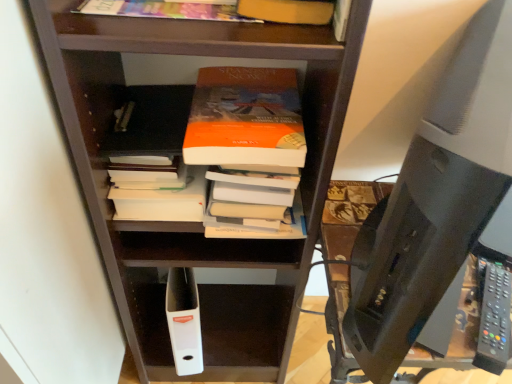
Question: Could you tell me if brown wooden shelf at center is facing white matte book at center, which ranks as the third book in top-to-bottom order?

Choices:
 (A) yes
 (B) no

Answer: (A)

Question: Is brown wooden shelf at center shorter than white matte book at center, which is the 3th book in front-to-back order?

Choices:
 (A) no
 (B) yes

Answer: (A)

Question: Is brown wooden shelf at center facing away from white matte book at center, which is the first book in back-to-front order?

Choices:
 (A) yes
 (B) no

Answer: (A)

Question: Would you consider brown wooden shelf at center to be distant from white matte book at center, which is the 3th book in front-to-back order?

Choices:
 (A) yes
 (B) no

Answer: (B)

Question: From the image's perspective, would you say brown wooden shelf at center is shown under white matte book at center, which appears as the first book when ordered from the bottom?

Choices:
 (A) no
 (B) yes

Answer: (B)

Question: Is brown wooden shelf at center spatially inside white matte book at center, which is the first book in back-to-front order, or outside of it?

Choices:
 (A) outside
 (B) inside

Answer: (A)

Question: From their relative heights in the image, would you say brown wooden shelf at center is taller or shorter than white matte book at center, which appears as the first book when ordered from the bottom?

Choices:
 (A) short
 (B) tall

Answer: (B)

Question: Based on their positions, is brown wooden shelf at center located to the left or right of white matte book at center, which is the first book in back-to-front order?

Choices:
 (A) left
 (B) right

Answer: (B)

Question: Relative to white matte book at center, which is the 3th book in front-to-back order, is brown wooden shelf at center in front or behind?

Choices:
 (A) behind
 (B) front

Answer: (B)

Question: Is white matte book at center, which is the 3th book in front-to-back order, in front of or behind multicolored paper at upper center, the first book when ordered from front to back, in the image?

Choices:
 (A) front
 (B) behind

Answer: (B)

Question: Is white matte book at center, which is the first book in back-to-front order, inside or outside of multicolored paper at upper center, placed as the 1th book when sorted from top to bottom?

Choices:
 (A) inside
 (B) outside

Answer: (B)

Question: In terms of size, does white matte book at center, which appears as the first book when ordered from the bottom, appear bigger or smaller than multicolored paper at upper center, placed as the 1th book when sorted from top to bottom?

Choices:
 (A) small
 (B) big

Answer: (A)

Question: In the image, is white matte book at center, which ranks as the third book in top-to-bottom order, on the left side or the right side of multicolored paper at upper center, positioned as the third book in bottom-to-top order?

Choices:
 (A) left
 (B) right

Answer: (A)

Question: Is multicolored paper at upper center, placed as the 1th book when sorted from top to bottom, taller or shorter than brown wooden shelf at center?

Choices:
 (A) tall
 (B) short

Answer: (B)

Question: Would you say multicolored paper at upper center, placed as the 1th book when sorted from top to bottom, is inside or outside brown wooden shelf at center?

Choices:
 (A) outside
 (B) inside

Answer: (A)